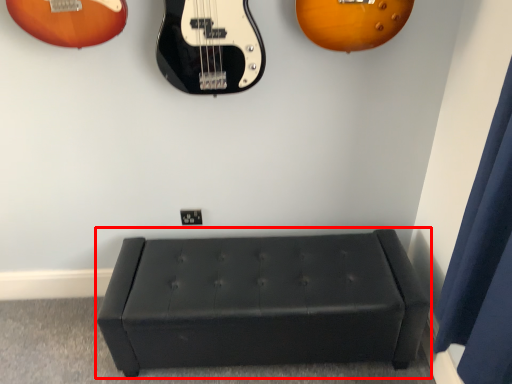
Question: From the image's perspective, where is furniture (annotated by the red box) located in relation to curtain in the image?

Choices:
 (A) below
 (B) above

Answer: (A)